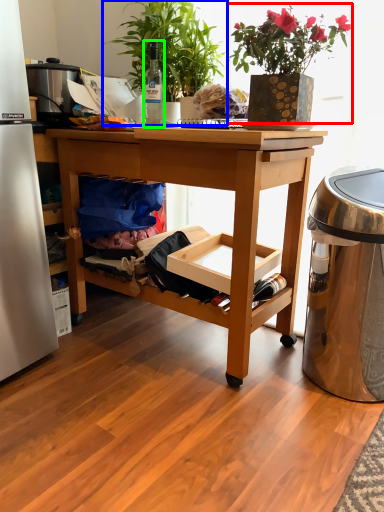
Question: Which object is positioned farthest from houseplant (highlighted by a red box)? Select from houseplant (highlighted by a blue box) and bottle (highlighted by a green box).

Choices:
 (A) houseplant
 (B) bottle

Answer: (B)